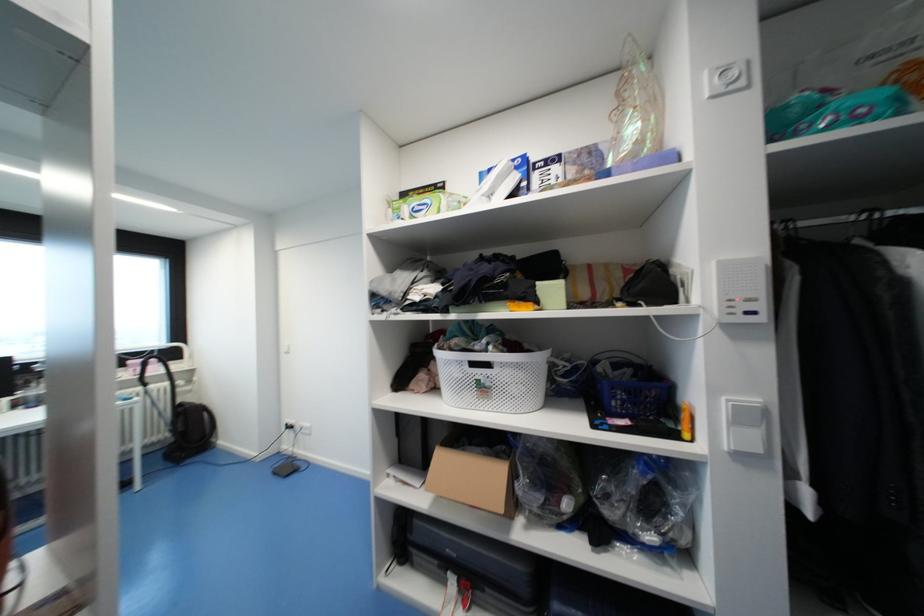
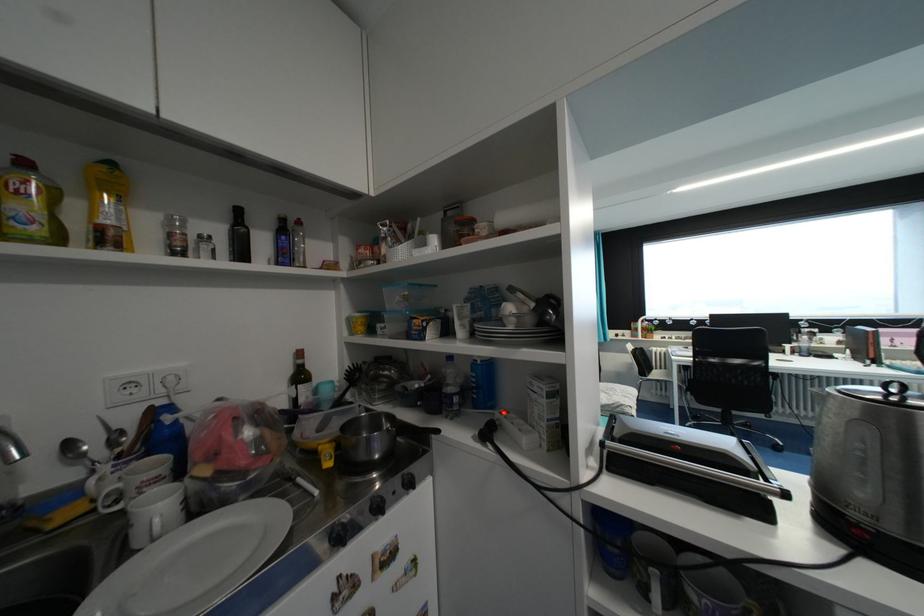
Question: The first image is from the beginning of the video and the second image is from the end. How did the camera likely rotate when shooting the video?

Choices:
 (A) Left
 (B) Right
 (C) Up
 (D) Down

Answer: (A)